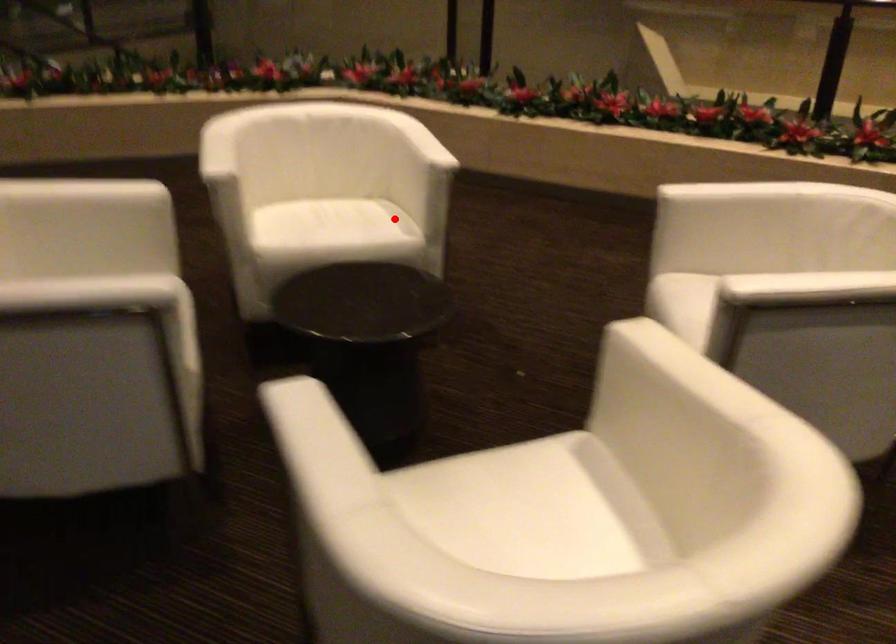
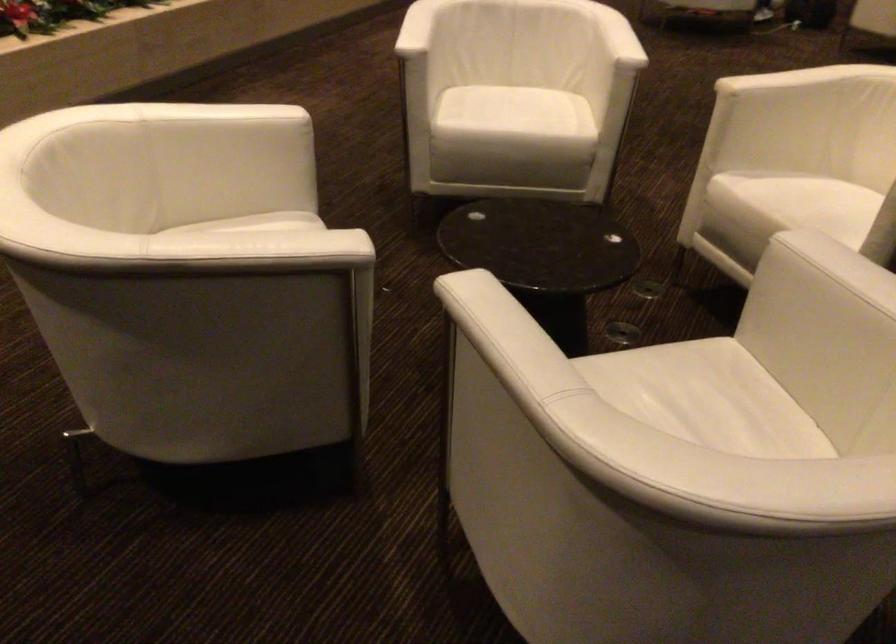
Question: I am providing you with two images of the same scene from different viewpoints. Image1 has a red point marked. In image2, the corresponding 3D location appears at what relative position? Reply with the corresponding letter.

Choices:
 (A) Closer
 (B) Farther

Answer: (A)